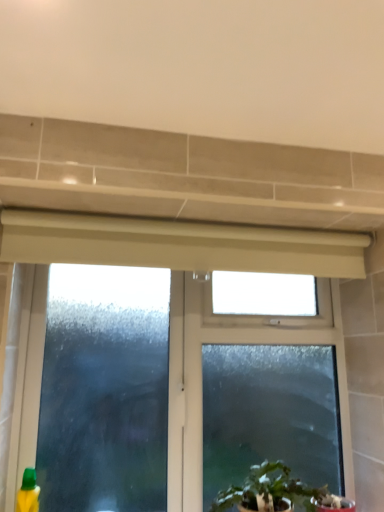
Question: Considering the relative sizes of green leafy plant at lower center and green plastic bottle at lower left in the image provided, is green leafy plant at lower center taller than green plastic bottle at lower left?

Choices:
 (A) no
 (B) yes

Answer: (A)

Question: Does green leafy plant at lower center appear on the right side of green plastic bottle at lower left?

Choices:
 (A) no
 (B) yes

Answer: (B)

Question: From a real-world perspective, is green leafy plant at lower center on top of green plastic bottle at lower left?

Choices:
 (A) yes
 (B) no

Answer: (A)

Question: Considering the relative sizes of green leafy plant at lower center and green plastic bottle at lower left in the image provided, is green leafy plant at lower center bigger than green plastic bottle at lower left?

Choices:
 (A) yes
 (B) no

Answer: (A)

Question: Is green plastic bottle at lower left located within green leafy plant at lower center?

Choices:
 (A) yes
 (B) no

Answer: (B)

Question: Considering the positions of frosted glass window at center and green leafy plant at lower center in the image, is frosted glass window at center wider or thinner than green leafy plant at lower center?

Choices:
 (A) thin
 (B) wide

Answer: (A)

Question: Relative to green leafy plant at lower center, is frosted glass window at center in front or behind?

Choices:
 (A) behind
 (B) front

Answer: (A)

Question: Based on their sizes in the image, would you say frosted glass window at center is bigger or smaller than green leafy plant at lower center?

Choices:
 (A) small
 (B) big

Answer: (B)

Question: Considering the relative positions of frosted glass window at center and green leafy plant at lower center in the image provided, is frosted glass window at center to the left or to the right of green leafy plant at lower center?

Choices:
 (A) left
 (B) right

Answer: (A)

Question: Relative to green leafy plant at lower center, is green plastic bottle at lower left in front or behind?

Choices:
 (A) front
 (B) behind

Answer: (B)

Question: Does point (26, 495) appear closer or farther from the camera than point (314, 492)?

Choices:
 (A) farther
 (B) closer

Answer: (B)

Question: Considering the positions of green plastic bottle at lower left and green leafy plant at lower center in the image, is green plastic bottle at lower left wider or thinner than green leafy plant at lower center?

Choices:
 (A) thin
 (B) wide

Answer: (A)

Question: From a real-world perspective, is green plastic bottle at lower left physically located above or below green leafy plant at lower center?

Choices:
 (A) below
 (B) above

Answer: (A)

Question: From the image's perspective, is green leafy plant at lower center positioned above or below green plastic bottle at lower left?

Choices:
 (A) above
 (B) below

Answer: (A)

Question: In terms of size, does green leafy plant at lower center appear bigger or smaller than green plastic bottle at lower left?

Choices:
 (A) small
 (B) big

Answer: (B)